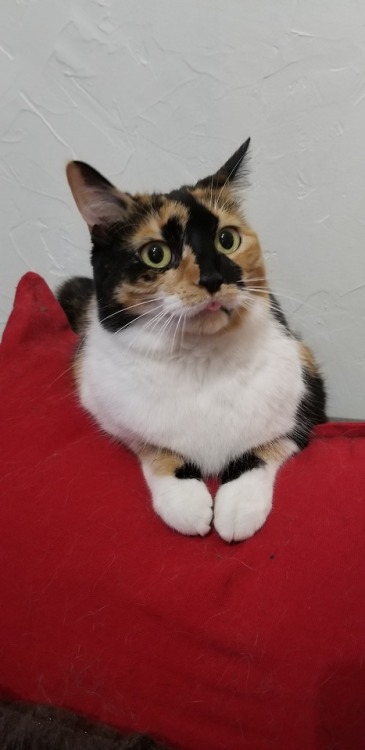
Identify the location of pillow. (36, 361).